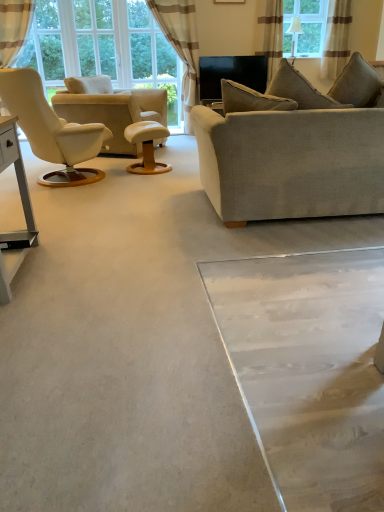
What are the coordinates of `free space behind white wood table at left` in the screenshot? It's located at (64, 234).